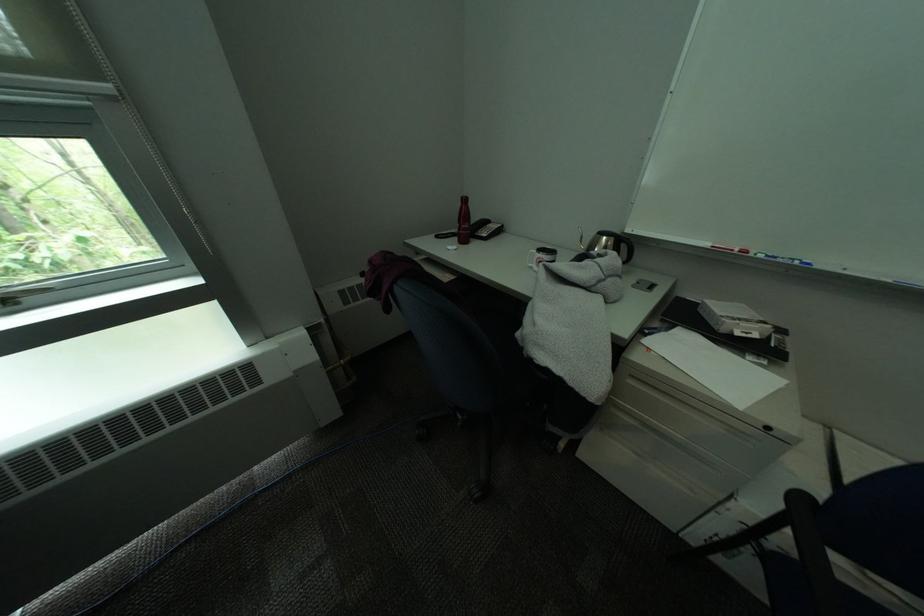
Find where to lift the black kettle handle. Please return your answer as a coordinate pair (x, y).

(613, 264)